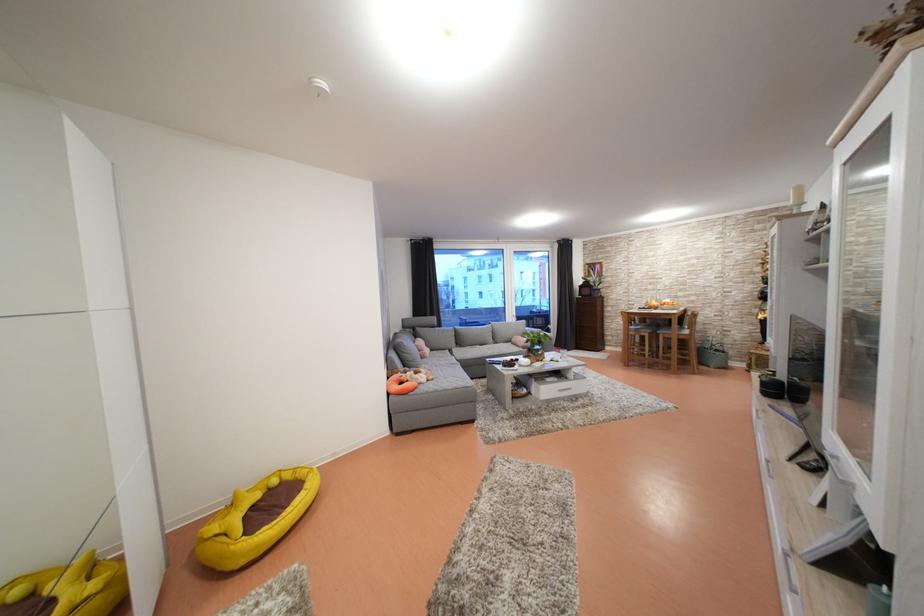
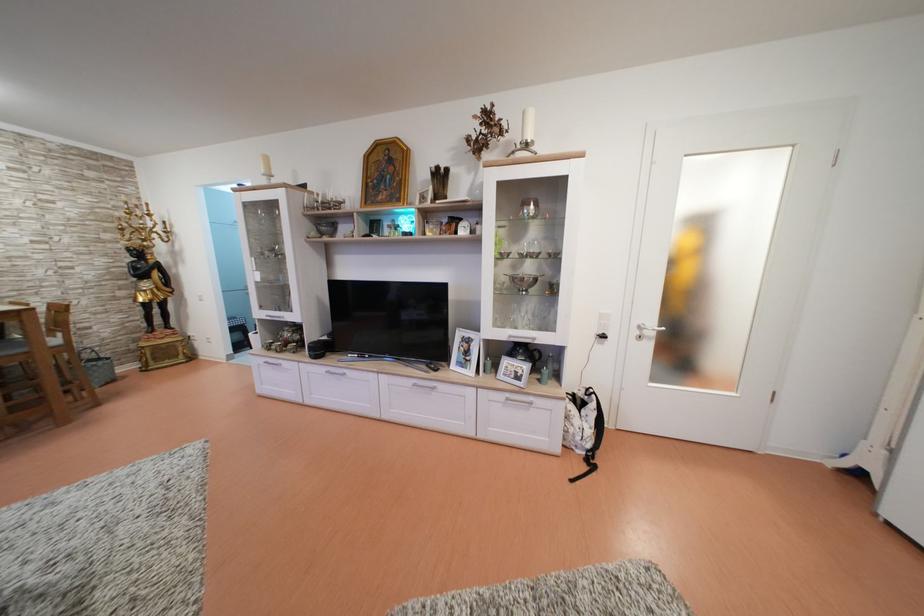
Where in the second image is the point corresponding to the point at 724,353 from the first image?

(96, 361)